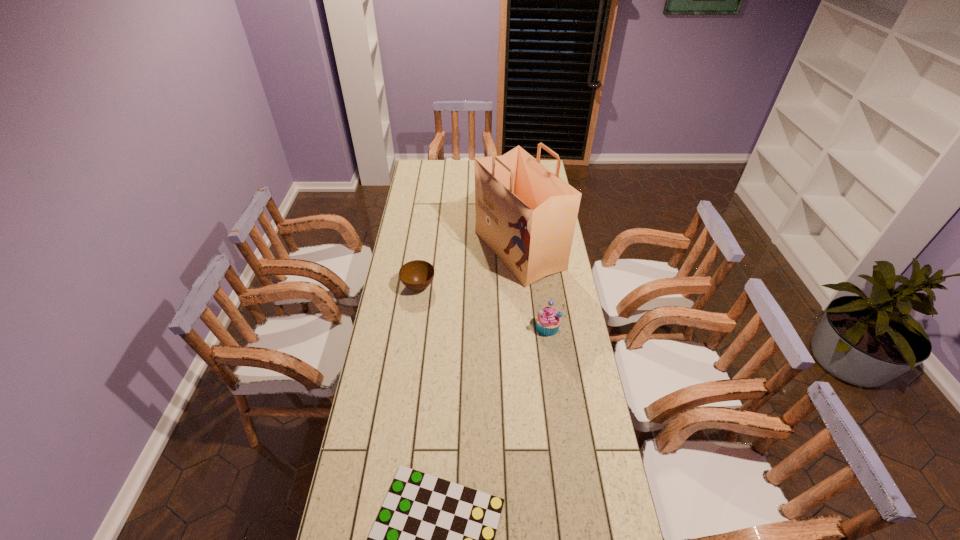
Where is `free space that satisfies the following two spatial constraints: 1. on the side of the grocery bag with the superhero design; 2. on the right side of the third farthest object`? free space that satisfies the following two spatial constraints: 1. on the side of the grocery bag with the superhero design; 2. on the right side of the third farthest object is located at coordinates (527, 327).

Where is `free space that satisfies the following two spatial constraints: 1. on the side of the grocery bag with the superhero design; 2. on the right side of the muffin`? The image size is (960, 540). free space that satisfies the following two spatial constraints: 1. on the side of the grocery bag with the superhero design; 2. on the right side of the muffin is located at coordinates (527, 327).

Where is `free region that satisfies the following two spatial constraints: 1. on the side of the tallest object with the superhero design; 2. on the back side of the third farthest object`? free region that satisfies the following two spatial constraints: 1. on the side of the tallest object with the superhero design; 2. on the back side of the third farthest object is located at coordinates [527, 327].